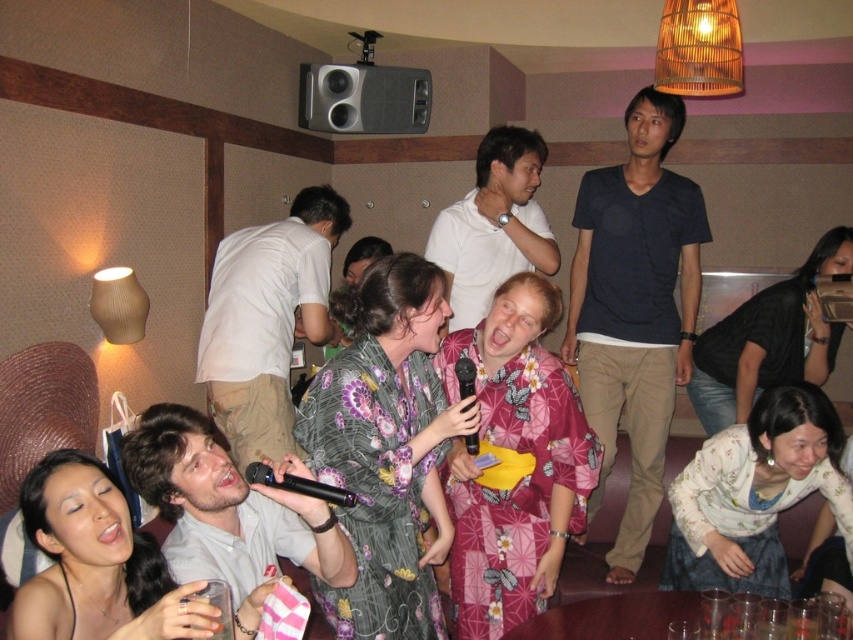
You are standing in the karaoke bar and want to hand a microphone to the person wearing the white cotton shirt at center. Based on their position, where exactly should you look to find them?

The white cotton shirt at center is located at point 0.502 on the x axis and 0.313 on the y axis.

You are taking a photo of the karaoke scene and want to focus on both the point at coordinates point [611,305] and point [474,452]. Which point is closer to the camera?

Point [474,452] is closer to the camera because point [611,305] is further away.

You are a photographer trying to capture a clear shot of the black plastic microphone at lower center during the karaoke performance. However, the white cotton shirt at upper center is blocking your view. Can you adjust your position to see the microphone without moving the shirt?

The black plastic microphone at lower center is behind the white cotton shirt at upper center, so you can move your position slightly to the side or lower your angle to see around the white cotton shirt at upper center and capture the microphone.